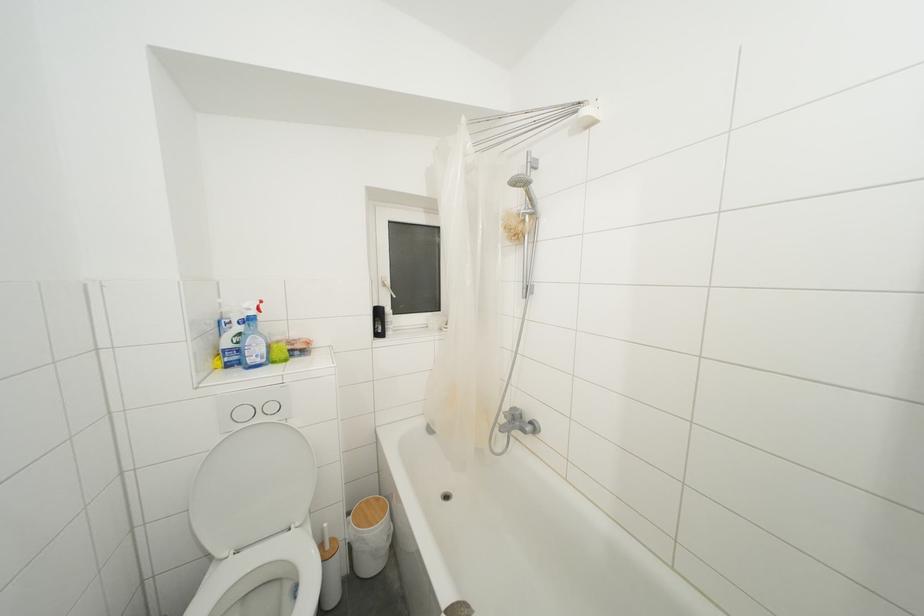
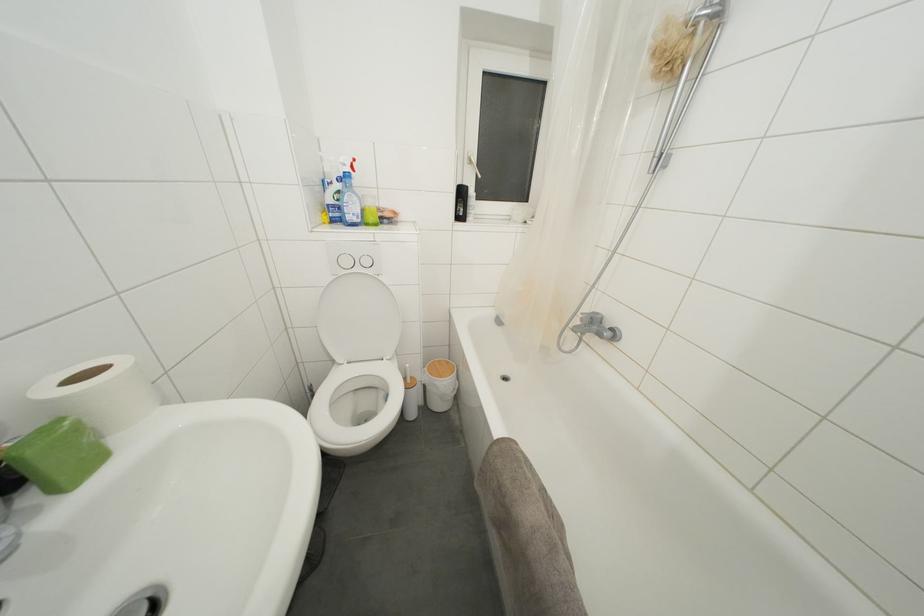
In a continuous first-person perspective shot, in which direction is the camera moving?

The movement direction of the cameraman is left, forward.